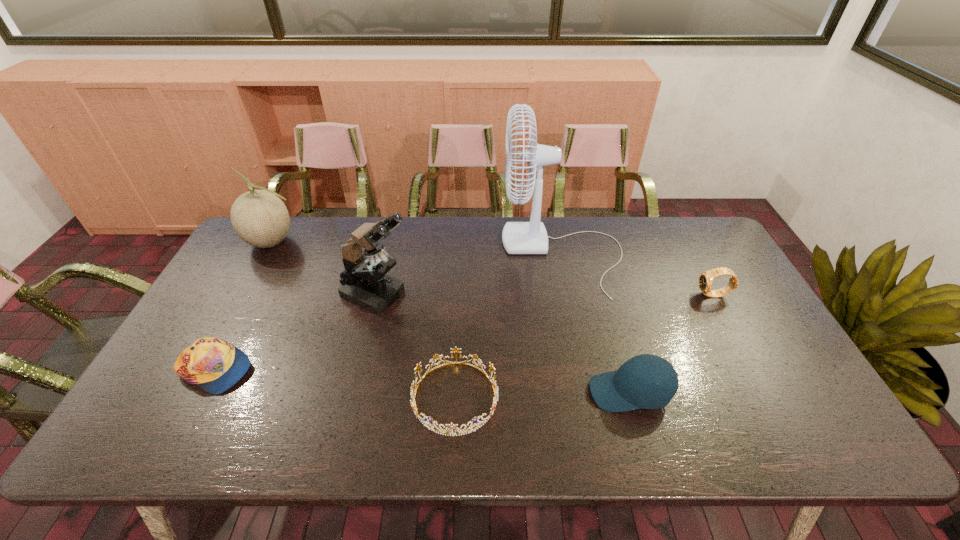
Where is `fan`? Image resolution: width=960 pixels, height=540 pixels. fan is located at coordinates (531, 237).

Where is `the sixth shortest object`? The height and width of the screenshot is (540, 960). the sixth shortest object is located at coordinates (371, 288).

At what (x,y) coordinates should I click in order to perform the action: click on the third object from left to right. Please return your answer as a coordinate pair (x, y). Looking at the image, I should click on (371, 288).

Identify the location of the third tallest object. This screenshot has height=540, width=960. (260, 218).

The width and height of the screenshot is (960, 540). Find the location of `baseball cap`. baseball cap is located at coordinates (622, 390).

This screenshot has height=540, width=960. What are the coordinates of `the fifth tallest object` in the screenshot? It's located at (705, 282).

Locate an element on the screen. The width and height of the screenshot is (960, 540). watch is located at coordinates (705, 282).

Locate an element on the screen. This screenshot has width=960, height=540. cap is located at coordinates (215, 365).

At what (x,y) coordinates should I click in order to perform the action: click on the fourth object from left to right. Please return your answer as a coordinate pair (x, y). Looking at the image, I should click on (449, 429).

The height and width of the screenshot is (540, 960). Find the location of `vacant space located on the front-facing side of the tallest object`. vacant space located on the front-facing side of the tallest object is located at coordinates (409, 254).